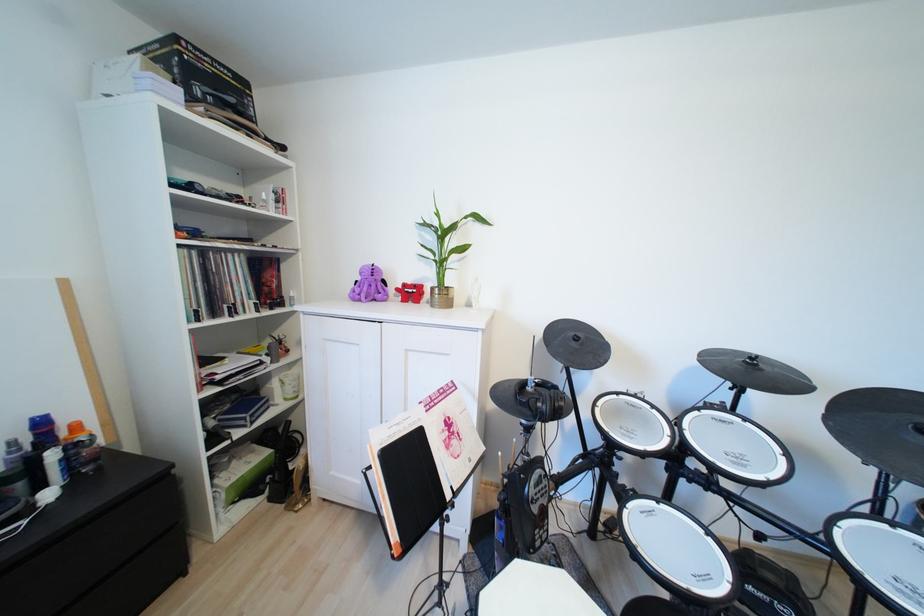
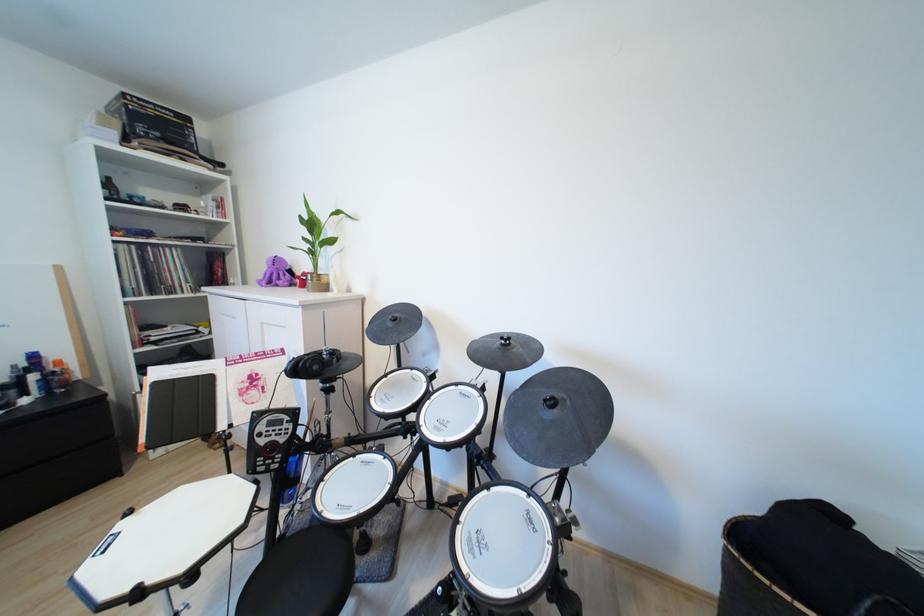
The point at (580, 346) is marked in the first image. Where is the corresponding point in the second image?

(396, 325)